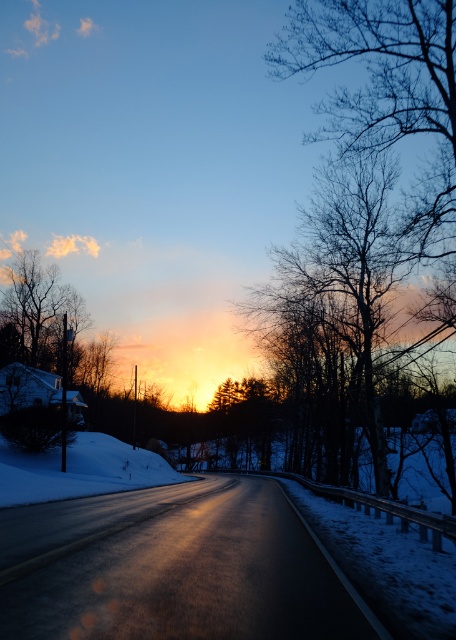
Looking at this image, you are driving a car and need to park near the white powdery snow at lower left and the silhouette bare tree at upper left. Which object will you be closer to if you park at the center of the road?

The white powdery snow at lower left is larger in size than the silhouette bare tree at upper left, so parking at the center of the road would place you closer to the white powdery snow at lower left.

You are driving a car and want to park near the white powdery snow at lower left and the silhouette bare tree at upper left. Which object is closer to the road?

The white powdery snow at lower left is closer to the road because it is positioned on the right side of the silhouette bare tree at upper left, which is further away from the road.

You are driving a car and need to park near the bare branches at center and the white powdery snow at lower left. Which object will be closer to your car once parked?

The bare branches at center will be closer to your car because it is in front of the white powdery snow at lower left.